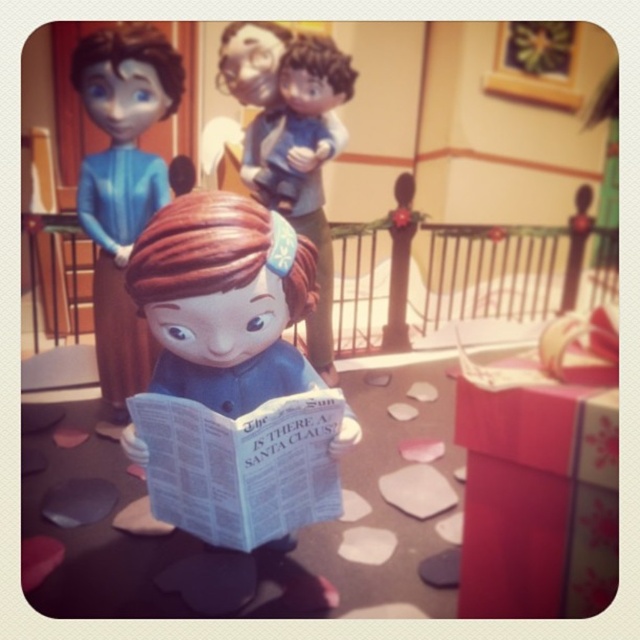
Is the position of matte plastic figurine at center more distant than that of smooth plastic figurine at upper center?

No.

Who is more forward, (179, 385) or (323, 316)?

Positioned in front is point (179, 385).

Locate an element on the screen. The image size is (640, 640). matte plastic figurine at center is located at coordinates pos(224,300).

Is matte blue doll at center positioned at the back of smooth plastic figurine at upper center?

No.

Is matte blue doll at center thinner than smooth plastic figurine at upper center?

Indeed, matte blue doll at center has a lesser width compared to smooth plastic figurine at upper center.

Is point (148, 376) less distant than point (273, 45)?

Yes.

Identify the location of matte blue doll at center. The image size is (640, 640). (122, 186).

Is point (221, 252) closer to viewer compared to point (294, 435)?

Yes, it is.

Is matte plastic figurine at center shorter than white paper book at center?

Incorrect, matte plastic figurine at center's height does not fall short of white paper book at center's.

Does point (209, 342) come behind point (168, 464)?

No, (209, 342) is in front of (168, 464).

Find the location of a particular element. This screenshot has height=640, width=640. matte plastic figurine at center is located at coordinates (224, 300).